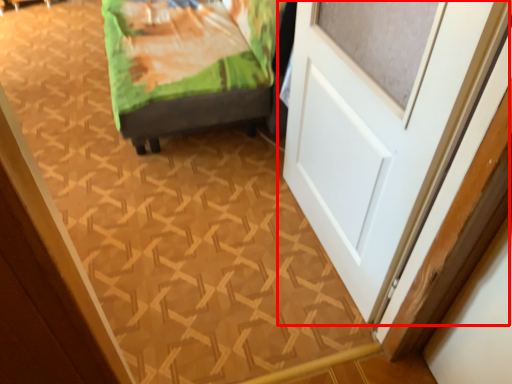
Question: Observing the image, what is the correct spatial positioning of door (annotated by the red box) in reference to furniture?

Choices:
 (A) right
 (B) left

Answer: (A)